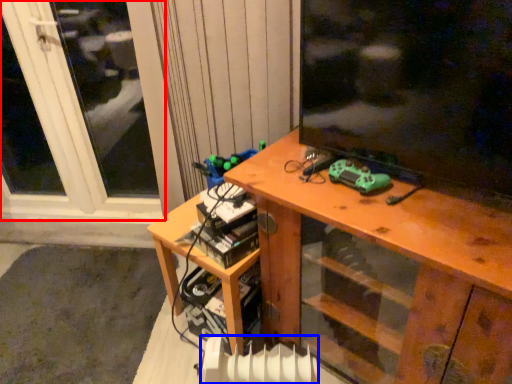
Question: Among these objects, which one is farthest to the camera, window (highlighted by a red box) or radiator (highlighted by a blue box)?

Choices:
 (A) window
 (B) radiator

Answer: (A)